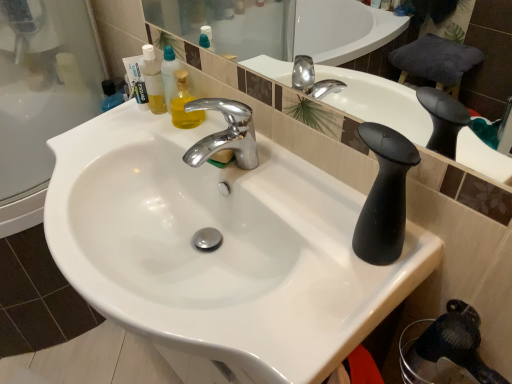
Question: Considering the relative sizes of white glossy sink at center and translucent plastic mouthwash at upper left in the image provided, is white glossy sink at center taller than translucent plastic mouthwash at upper left?

Choices:
 (A) yes
 (B) no

Answer: (A)

Question: Would you say white glossy sink at center is outside translucent plastic mouthwash at upper left?

Choices:
 (A) no
 (B) yes

Answer: (B)

Question: Considering the relative sizes of white glossy sink at center and translucent plastic mouthwash at upper left in the image provided, is white glossy sink at center smaller than translucent plastic mouthwash at upper left?

Choices:
 (A) no
 (B) yes

Answer: (A)

Question: Does white glossy sink at center have a larger size compared to translucent plastic mouthwash at upper left?

Choices:
 (A) yes
 (B) no

Answer: (A)

Question: From the image's perspective, is white glossy sink at center over translucent plastic mouthwash at upper left?

Choices:
 (A) yes
 (B) no

Answer: (B)

Question: Considering the relative positions of white glossy sink at center and translucent plastic mouthwash at upper left in the image provided, is white glossy sink at center in front of translucent plastic mouthwash at upper left?

Choices:
 (A) yes
 (B) no

Answer: (A)

Question: Does white matte toothpaste tube at upper left contain translucent plastic mouthwash at upper left?

Choices:
 (A) yes
 (B) no

Answer: (B)

Question: Is white matte toothpaste tube at upper left thinner than translucent plastic mouthwash at upper left?

Choices:
 (A) no
 (B) yes

Answer: (A)

Question: Is the depth of white matte toothpaste tube at upper left less than that of translucent plastic mouthwash at upper left?

Choices:
 (A) no
 (B) yes

Answer: (A)

Question: From a real-world perspective, is white matte toothpaste tube at upper left located higher than translucent plastic mouthwash at upper left?

Choices:
 (A) no
 (B) yes

Answer: (A)

Question: Can you confirm if white matte toothpaste tube at upper left is positioned to the right of translucent plastic mouthwash at upper left?

Choices:
 (A) yes
 (B) no

Answer: (B)

Question: From the image's perspective, is white matte toothpaste tube at upper left under translucent plastic mouthwash at upper left?

Choices:
 (A) yes
 (B) no

Answer: (A)

Question: Is translucent plastic mouthwash at upper left placed right next to white glossy sink at center?

Choices:
 (A) yes
 (B) no

Answer: (B)